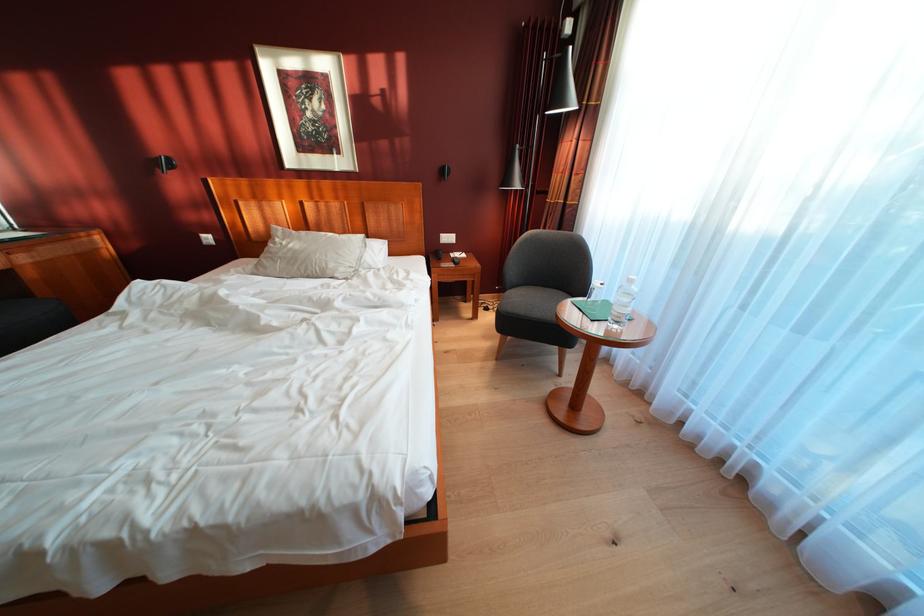
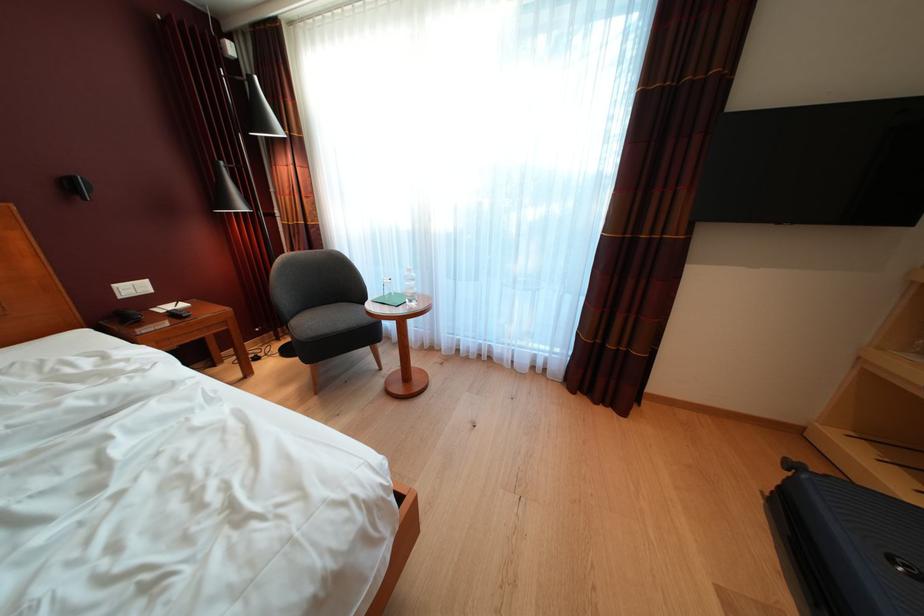
Question: The first image is from the beginning of the video and the second image is from the end. How did the camera likely rotate when shooting the video?

Choices:
 (A) Left
 (B) Right
 (C) Up
 (D) Down

Answer: (B)